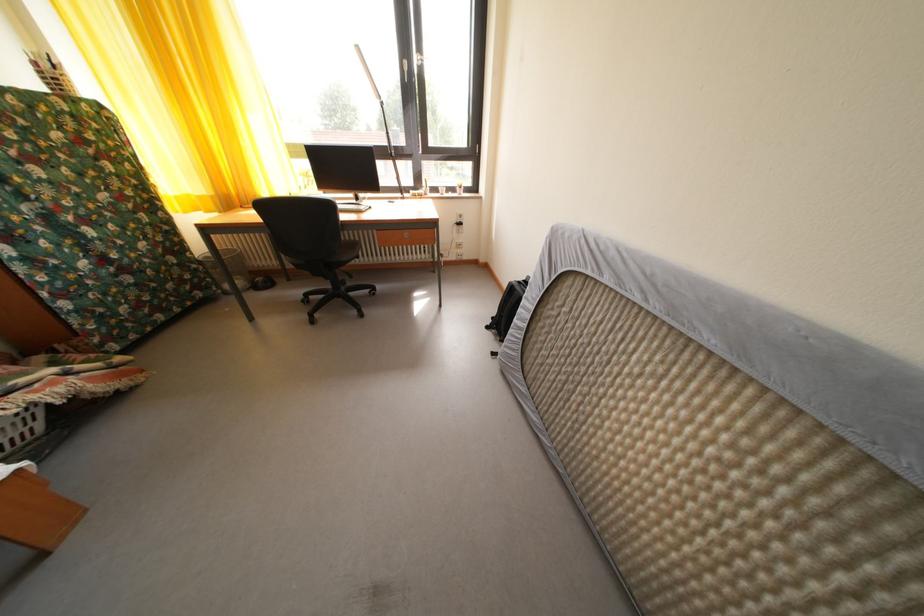
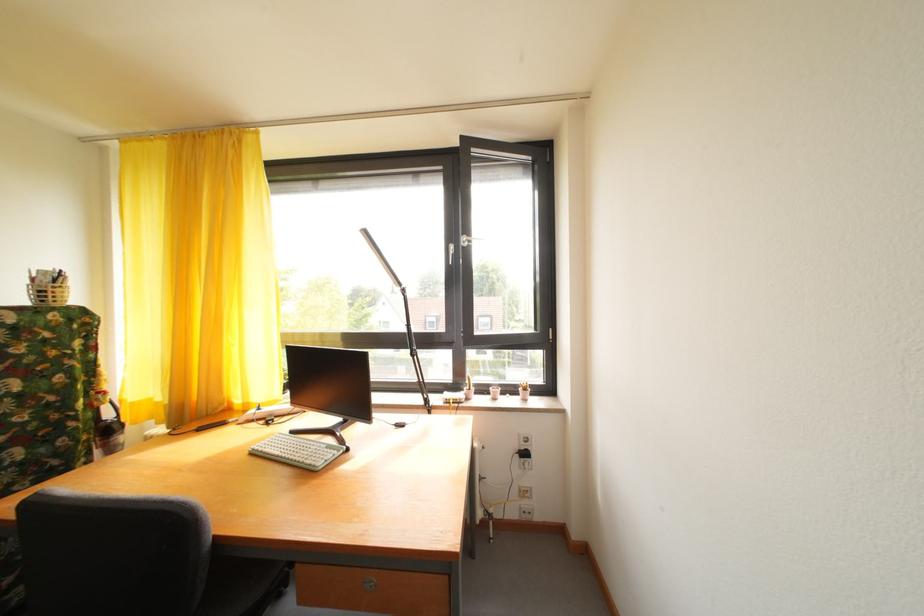
In the second image, find the point that corresponds to point 444,196 in the first image.

(492, 395)